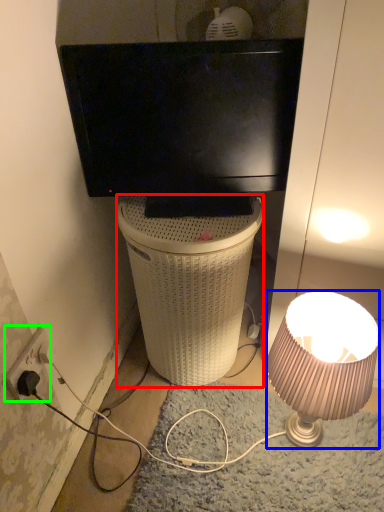
Question: Estimate the real-world distances between objects in this image. Which object is farther from trash bin/can (highlighted by a red box), lamp (highlighted by a blue box) or power outlet (highlighted by a green box)?

Choices:
 (A) lamp
 (B) power outlet

Answer: (B)